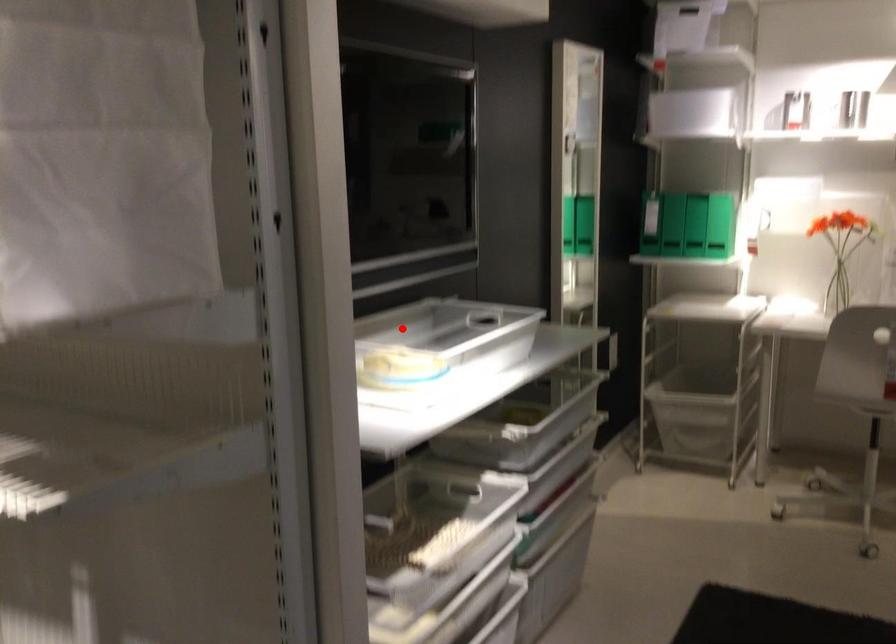
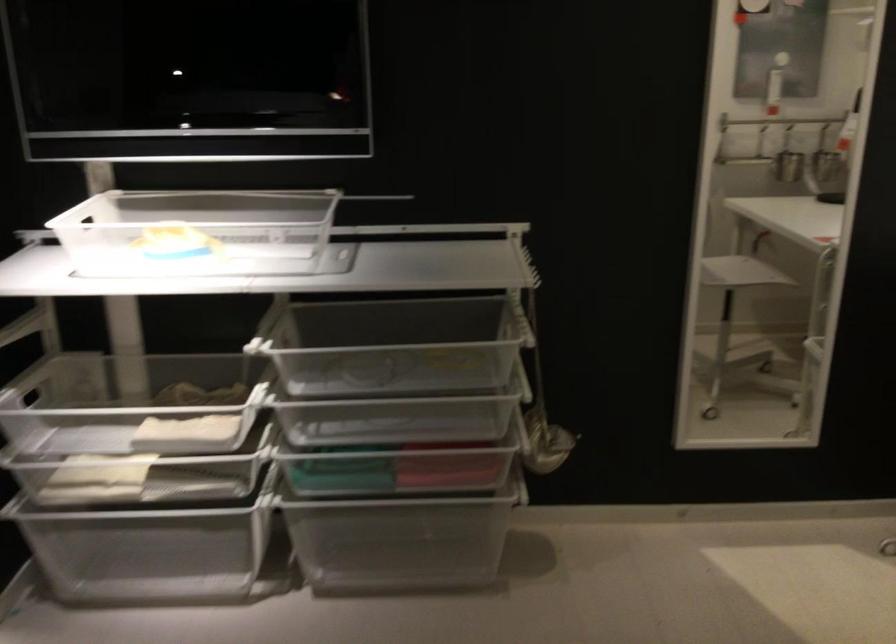
Question: I am providing you with two images of the same scene from different viewpoints. A red point is shown in image1. For the corresponding object point in image2, is it positioned nearer or farther from the camera?

Choices:
 (A) Nearer
 (B) Farther

Answer: (A)